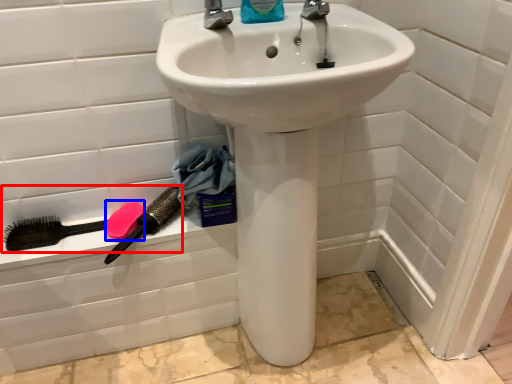
Question: Among these objects, which one is farthest to the camera, brush (highlighted by a red box) or soap (highlighted by a blue box)?

Choices:
 (A) brush
 (B) soap

Answer: (B)